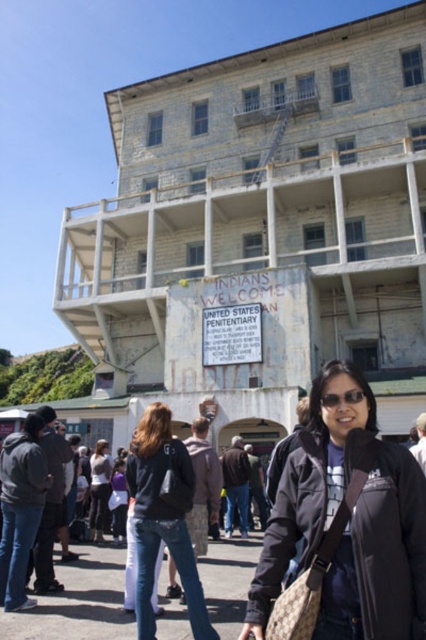
Does black matte jacket at lower right come behind denim jeans at center?

No.

Does black matte jacket at lower right have a greater width compared to denim jeans at center?

Correct, the width of black matte jacket at lower right exceeds that of denim jeans at center.

The height and width of the screenshot is (640, 426). In order to click on black matte jacket at lower right in this screenshot , I will do `click(342, 528)`.